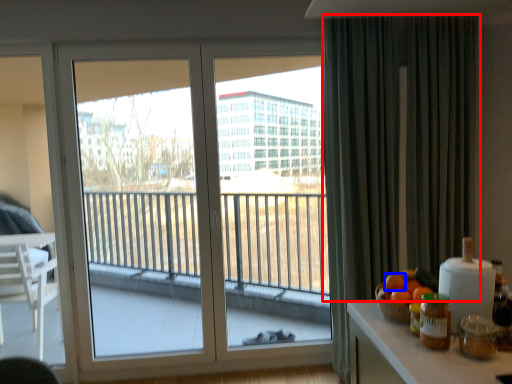
Question: Which object is further to the camera taking this photo, curtain (highlighted by a red box) or orange (highlighted by a blue box)?

Choices:
 (A) curtain
 (B) orange

Answer: (A)